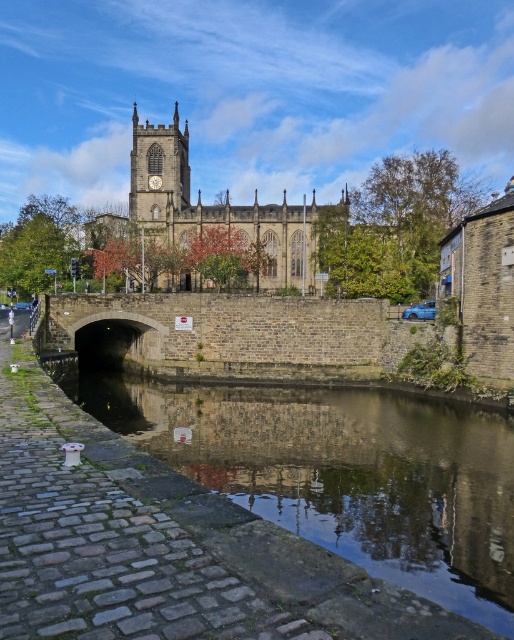
Question: Which object is the farthest from the stone clock tower at upper center?

Choices:
 (A) smooth stone river at lower left
 (B) stone church at center

Answer: (A)

Question: Considering the real-world distances, which object is closest to the stone clock tower at upper center?

Choices:
 (A) stone church at center
 (B) smooth stone river at lower left

Answer: (A)

Question: Does smooth stone river at lower left appear on the right side of stone clock tower at upper center?

Choices:
 (A) no
 (B) yes

Answer: (B)

Question: Is stone church at center to the right of stone clock tower at upper center from the viewer's perspective?

Choices:
 (A) no
 (B) yes

Answer: (B)

Question: Does stone church at center lie in front of stone clock tower at upper center?

Choices:
 (A) yes
 (B) no

Answer: (A)

Question: Based on their relative distances, which object is nearer to the stone clock tower at upper center?

Choices:
 (A) smooth stone river at lower left
 (B) stone church at center

Answer: (B)